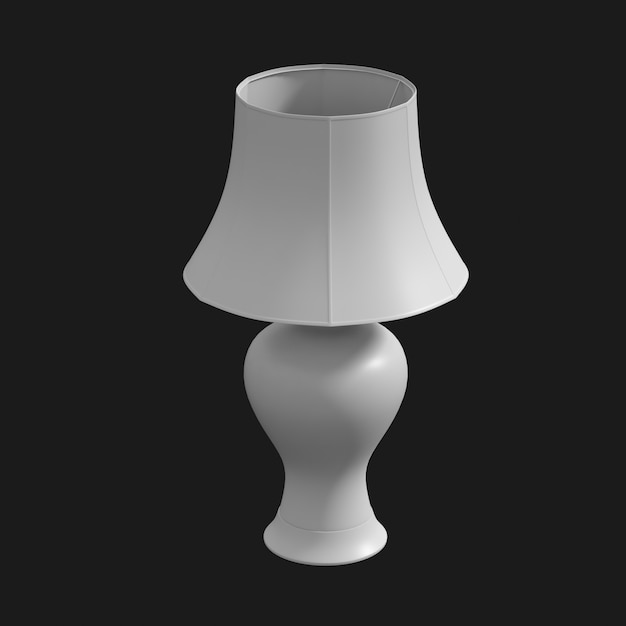
Find the location of a particular element. The width and height of the screenshot is (626, 626). base of lamp is located at coordinates (337, 546).